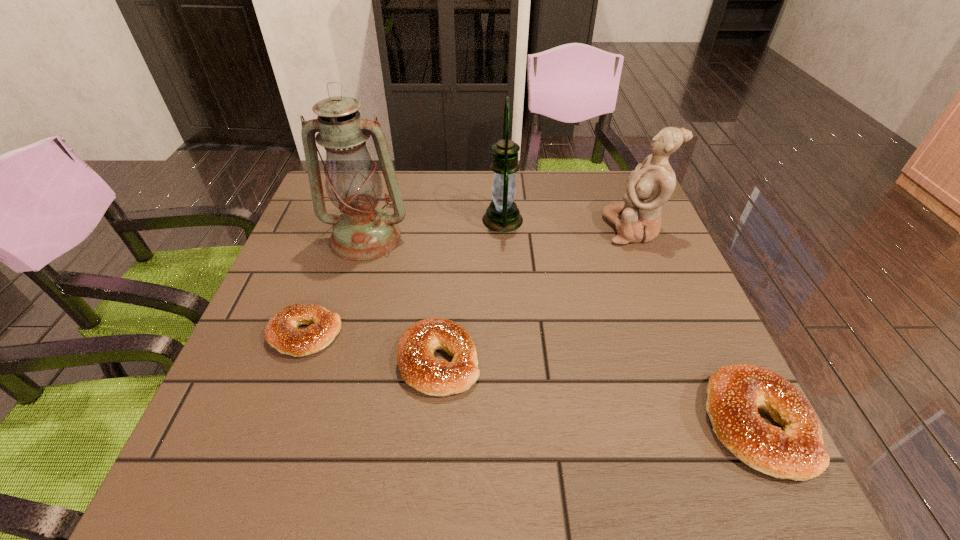
You are a GUI agent. You are given a task and a screenshot of the screen. Output one action in this format:
    pyautogui.click(x=<x>, y=<y>)
    Task: Click on the free space at the near edge of the desktop
    This screenshot has height=540, width=960.
    Given the screenshot: What is the action you would take?
    pyautogui.click(x=536, y=417)

I want to click on free space at the right edge of the desktop, so click(621, 289).

In the image, there is a desktop. Where is `vacant space at the near left corner`? Image resolution: width=960 pixels, height=540 pixels. vacant space at the near left corner is located at coordinates [274, 392].

You are a GUI agent. You are given a task and a screenshot of the screen. Output one action in this format:
    pyautogui.click(x=<x>, y=<y>)
    Task: Click on the free space at the far right corner
    The image size is (960, 540).
    Given the screenshot: What is the action you would take?
    pyautogui.click(x=588, y=194)

At what (x,y) coordinates should I click in order to perform the action: click on empty location between the fifth shortest object and the rightmost bagel. Please return your answer as a coordinate pair (x, y). The width and height of the screenshot is (960, 540). Looking at the image, I should click on (630, 322).

Where is `vacant space that is in between the second tallest object and the leftmost bagel`? The image size is (960, 540). vacant space that is in between the second tallest object and the leftmost bagel is located at coordinates (404, 277).

Find the location of `free space between the second bagel from left to right and the third tallest object`. free space between the second bagel from left to right and the third tallest object is located at coordinates (536, 295).

Locate an element on the screen. Image resolution: width=960 pixels, height=540 pixels. free spot between the lantern and the leftmost bagel is located at coordinates (404, 277).

Identify the location of free point between the leftmost bagel and the figurine. This screenshot has width=960, height=540. (469, 281).

This screenshot has height=540, width=960. What are the coordinates of `free spot between the rightmost bagel and the shortest bagel` in the screenshot? It's located at (531, 379).